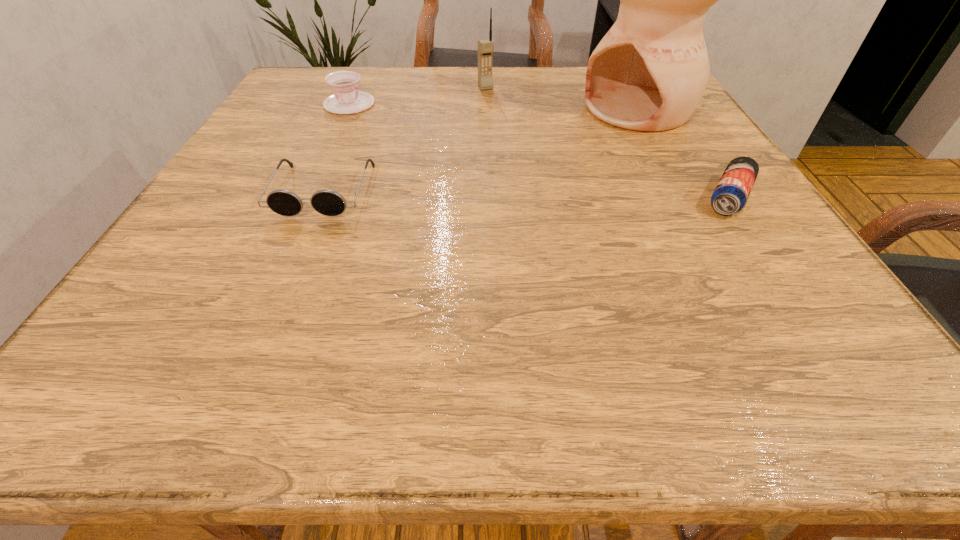
Identify the location of sunglasses located at the left edge. (327, 202).

The width and height of the screenshot is (960, 540). What are the coordinates of `teacup that is at the left edge` in the screenshot? It's located at (346, 99).

This screenshot has height=540, width=960. Identify the location of beer can positioned at the right edge. (731, 193).

Find the location of a particular element. The height and width of the screenshot is (540, 960). pottery at the right edge is located at coordinates (649, 72).

Identify the location of object located in the far left corner section of the desktop. The image size is (960, 540). (346, 99).

The width and height of the screenshot is (960, 540). I want to click on object present at the far right corner, so click(649, 72).

The height and width of the screenshot is (540, 960). In the image, there is a desktop. What are the coordinates of `vacant space at the far edge` in the screenshot? It's located at pyautogui.click(x=501, y=90).

In order to click on free space at the near edge in this screenshot , I will do `click(651, 301)`.

At what (x,y) coordinates should I click in order to perform the action: click on vacant space at the left edge. Please return your answer as a coordinate pair (x, y). Looking at the image, I should click on (183, 271).

In the image, there is a desktop. In order to click on vacant space at the right edge in this screenshot , I will do `click(773, 242)`.